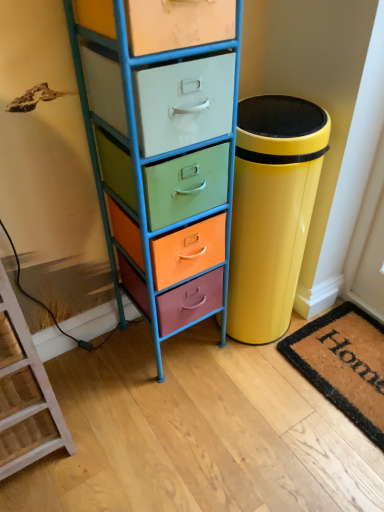
The height and width of the screenshot is (512, 384). I want to click on vacant space situated above coir doormat at lower right (from a real-world perspective), so click(x=347, y=356).